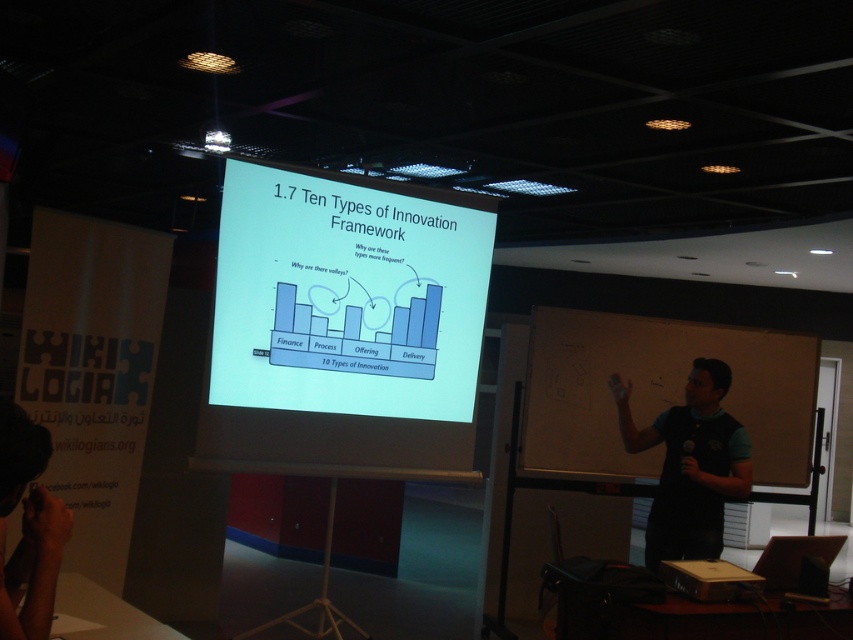
Can you confirm if white glossy projection screen at center is positioned above black fabric shirt at right?

Yes, white glossy projection screen at center is above black fabric shirt at right.

This screenshot has width=853, height=640. In order to click on white glossy projection screen at center in this screenshot , I will do `click(344, 323)`.

Between point (329, 429) and point (625, 381), which one is positioned in front?

Point (329, 429) is in front.

Find the location of `white glossy projection screen at center`. white glossy projection screen at center is located at coordinates (344, 323).

Identify the location of blackboard at right. The image size is (853, 640). (659, 392).

Who is shorter, blackboard at right or black fabric camera at lower left?

With less height is black fabric camera at lower left.

Identify the location of blackboard at right. The width and height of the screenshot is (853, 640). coord(659,392).

Image resolution: width=853 pixels, height=640 pixels. I want to click on blackboard at right, so click(659, 392).

Which is more to the right, white glossy projection screen at center or black fabric camera at lower left?

white glossy projection screen at center

Measure the distance between white glossy projection screen at center and camera.

→ white glossy projection screen at center and camera are 3.51 meters apart from each other.

The image size is (853, 640). What are the coordinates of `white glossy projection screen at center` in the screenshot? It's located at (344, 323).